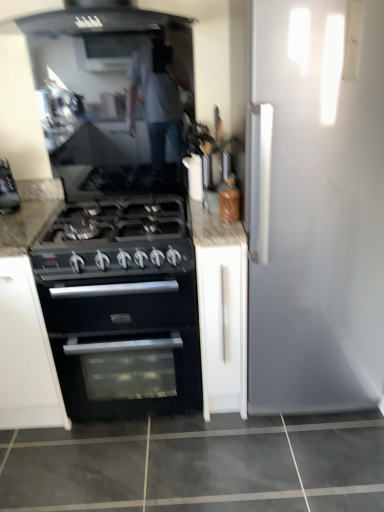
At what (x,y) coordinates should I click in order to perform the action: click on black matte oven at center. Please return your answer as a coordinate pair (x, y). Looking at the image, I should click on (126, 346).

What is the approximate height of black matte gas stove at center?

black matte gas stove at center is 6.24 inches in height.

Identify the location of white matte cabinet at center. The height and width of the screenshot is (512, 384). (221, 310).

Between black matte oven at center and white matte cabinet at center, which one appears on the left side from the viewer's perspective?

Positioned to the left is black matte oven at center.

Locate an element on the screen. The height and width of the screenshot is (512, 384). oven that is under the white matte cabinet at center (from a real-world perspective) is located at coordinates (126, 346).

What's the angular difference between black matte oven at center and white matte cabinet at center's facing directions?

They differ by 9.36e-05 degrees in their facing directions.

Which object is thinner, black matte oven at center or white matte cabinet at center?

With smaller width is white matte cabinet at center.

Is point (81, 181) closer or farther from the camera than point (243, 240)?

Point (81, 181) is positioned farther from the camera compared to point (243, 240).

Is black matte gas stove at center not within white matte cabinet at center?

Indeed, black matte gas stove at center is completely outside white matte cabinet at center.

What's the angular difference between black matte gas stove at center and white matte cabinet at center's facing directions?

The facing directions of black matte gas stove at center and white matte cabinet at center are 0.000297 degrees apart.

Considering the sizes of objects black matte gas stove at center and white matte cabinet at center in the image provided, who is thinner, black matte gas stove at center or white matte cabinet at center?

Thinner between the two is white matte cabinet at center.

Is white matte cabinet at center in front of or behind black matte gas stove at center in the image?

white matte cabinet at center is behind black matte gas stove at center.

Is white matte cabinet at center directly adjacent to black matte gas stove at center?

They are not placed beside each other.

Considering the sizes of objects white matte cabinet at center and black matte gas stove at center in the image provided, who is thinner, white matte cabinet at center or black matte gas stove at center?

white matte cabinet at center is thinner.

Which is more to the right, white matte cabinet at center or black matte gas stove at center?

Positioned to the right is white matte cabinet at center.

Where is `oven below the black matte gas stove at center (from the image's perspective)`? This screenshot has width=384, height=512. oven below the black matte gas stove at center (from the image's perspective) is located at coordinates (126, 346).

From the image's perspective, does black matte oven at center appear higher than black matte gas stove at center?

Actually, black matte oven at center appears below black matte gas stove at center in the image.

From the picture: Is black matte oven at center positioned with its back to black matte gas stove at center?

No, black matte oven at center is not facing the opposite direction of black matte gas stove at center.

Looking at this image, is black matte gas stove at center oriented away from black matte oven at center?

No, black matte gas stove at center's orientation is not away from black matte oven at center.

The image size is (384, 512). Find the location of `oven behind the black matte gas stove at center`. oven behind the black matte gas stove at center is located at coordinates (126, 346).

Between black matte gas stove at center and black matte oven at center, which one appears on the left side from the viewer's perspective?

black matte gas stove at center is more to the left.

Which of these two, black matte gas stove at center or black matte oven at center, is thinner?

black matte gas stove at center.

Which is more to the right, white matte cabinet at center or black matte oven at center?

Positioned to the right is white matte cabinet at center.

From the image's perspective, does white matte cabinet at center appear lower than black matte oven at center?

→ No, from the image's perspective, white matte cabinet at center is not beneath black matte oven at center.

Looking at this image, between white matte cabinet at center and black matte oven at center, which one has less height?

black matte oven at center is shorter.

What are the coordinates of `oven on the left of the white matte cabinet at center` in the screenshot? It's located at (126, 346).

At what (x,y) coordinates should I click in order to perform the action: click on cabinetry behind the black matte gas stove at center. Please return your answer as a coordinate pair (x, y). The image size is (384, 512). Looking at the image, I should click on (221, 310).

Looking at the image, which one is located closer to black matte oven at center, white matte cabinet at center or black matte gas stove at center?

white matte cabinet at center lies closer to black matte oven at center than the other object.

Which object lies further to the anchor point white matte cabinet at center, black matte gas stove at center or black matte oven at center?

The object further to white matte cabinet at center is black matte gas stove at center.

Which object lies nearer to the anchor point black matte oven at center, black matte gas stove at center or white matte cabinet at center?

Among the two, white matte cabinet at center is located nearer to black matte oven at center.

Which object lies nearer to the anchor point black matte gas stove at center, white matte cabinet at center or black matte oven at center?

white matte cabinet at center lies closer to black matte gas stove at center than the other object.

From the image, which object appears to be farther from white matte cabinet at center, black matte oven at center or black matte gas stove at center?

Based on the image, black matte gas stove at center appears to be further to white matte cabinet at center.

Considering their positions, is black matte oven at center positioned further to black matte gas stove at center than white matte cabinet at center?

Among the two, black matte oven at center is located further to black matte gas stove at center.

At what (x,y) coordinates should I click in order to perform the action: click on cabinetry between black matte gas stove at center and black matte oven at center in the vertical direction. Please return your answer as a coordinate pair (x, y). Looking at the image, I should click on (221, 310).